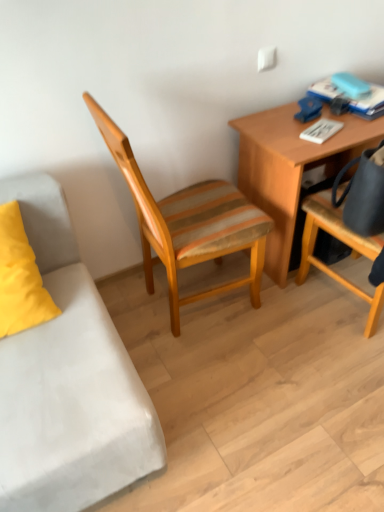
You are a GUI agent. You are given a task and a screenshot of the screen. Output one action in this format:
    pyautogui.click(x=<x>, y=<y>)
    Task: Click on the free space on the front side of matte black bag at right, the 1th chair positioned from the right
    
    Given the screenshot: What is the action you would take?
    pyautogui.click(x=341, y=387)